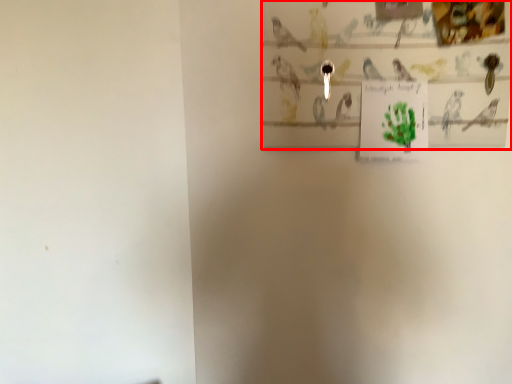
Question: From the image's perspective, where is picture frame (annotated by the red box) located relative to postcard?

Choices:
 (A) above
 (B) below

Answer: (A)